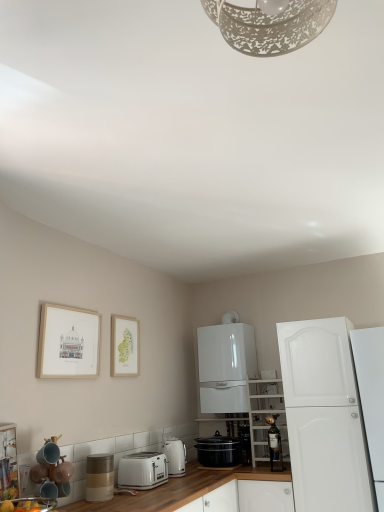
Question: Does white matte shelving unit at center-right, which is counted as the 2th cabinetry, starting from the left, appear on the left side of black glossy slow cooker at center, arranged as the 5th appliance when viewed from the front?

Choices:
 (A) yes
 (B) no

Answer: (B)

Question: Considering the relative sizes of white matte shelving unit at center-right, the 2th cabinetry viewed from the right, and black glossy slow cooker at center, arranged as the 5th appliance when viewed from the front, in the image provided, is white matte shelving unit at center-right, the 2th cabinetry viewed from the right, shorter than black glossy slow cooker at center, arranged as the 5th appliance when viewed from the front,?

Choices:
 (A) yes
 (B) no

Answer: (B)

Question: Considering the relative sizes of white matte shelving unit at center-right, which is counted as the 2th cabinetry, starting from the left, and black glossy slow cooker at center, arranged as the 1th appliance when viewed from the back, in the image provided, is white matte shelving unit at center-right, which is counted as the 2th cabinetry, starting from the left, taller than black glossy slow cooker at center, arranged as the 1th appliance when viewed from the back,?

Choices:
 (A) no
 (B) yes

Answer: (B)

Question: From the image's perspective, does white matte shelving unit at center-right, which is counted as the 2th cabinetry, starting from the left, appear higher than black glossy slow cooker at center, positioned as the second appliance in right-to-left order?

Choices:
 (A) yes
 (B) no

Answer: (A)

Question: From the image's perspective, would you say white matte shelving unit at center-right, which is counted as the 2th cabinetry, starting from the left, is shown under black glossy slow cooker at center, arranged as the 1th appliance when viewed from the back?

Choices:
 (A) yes
 (B) no

Answer: (B)

Question: Is metallic gold wine bottle at center, arranged as the fifth appliance when viewed from the left, in front of or behind white matte cabinet at right, acting as the 1th cabinetry starting from the right, in the image?

Choices:
 (A) behind
 (B) front

Answer: (A)

Question: From the image's perspective, is metallic gold wine bottle at center, arranged as the fifth appliance when viewed from the left, above or below white matte cabinet at right, acting as the 1th cabinetry starting from the right?

Choices:
 (A) below
 (B) above

Answer: (A)

Question: Is metallic gold wine bottle at center, which is counted as the 1th appliance, starting from the right, situated inside white matte cabinet at right, acting as the 1th cabinetry starting from the right, or outside?

Choices:
 (A) outside
 (B) inside

Answer: (A)

Question: In terms of size, does metallic gold wine bottle at center, the 4th appliance positioned from the front, appear bigger or smaller than white matte cabinet at right, the third cabinetry viewed from the left?

Choices:
 (A) small
 (B) big

Answer: (A)

Question: From the image's perspective, relative to matte white picture frame at upper left, the 2th picture frame when ordered from right to left, is black glossy slow cooker at center, positioned as the second appliance in right-to-left order, above or below?

Choices:
 (A) below
 (B) above

Answer: (A)

Question: Is point (243, 450) positioned closer to the camera than point (69, 338)?

Choices:
 (A) farther
 (B) closer

Answer: (A)

Question: From a real-world perspective, is black glossy slow cooker at center, arranged as the 1th appliance when viewed from the back, above or below matte white picture frame at upper left, which appears as the 1th picture frame when viewed from the front?

Choices:
 (A) below
 (B) above

Answer: (A)

Question: Considering the relative positions of black glossy slow cooker at center, arranged as the 5th appliance when viewed from the front, and matte white picture frame at upper left, which appears as the 1th picture frame when viewed from the front, in the image provided, is black glossy slow cooker at center, arranged as the 5th appliance when viewed from the front, to the left or to the right of matte white picture frame at upper left, which appears as the 1th picture frame when viewed from the front,?

Choices:
 (A) left
 (B) right

Answer: (B)

Question: Considering their positions, is white matte cabinet at right, acting as the 1th cabinetry starting from the right, located in front of or behind white glossy boiler at center, the 1th cabinetry from the left?

Choices:
 (A) front
 (B) behind

Answer: (A)

Question: Looking at their shapes, would you say white matte cabinet at right, the third cabinetry viewed from the left, is wider or thinner than white glossy boiler at center, the 1th cabinetry from the left?

Choices:
 (A) wide
 (B) thin

Answer: (A)